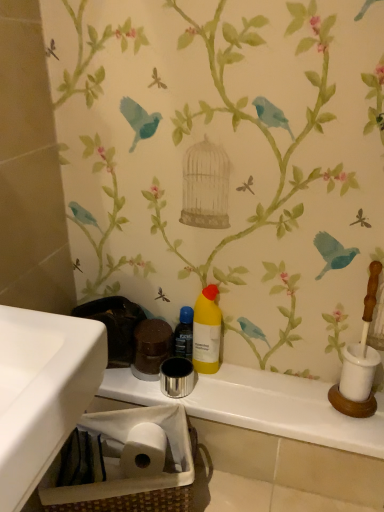
Identify the location of free space in front of yellow matte bottle at center. (228, 394).